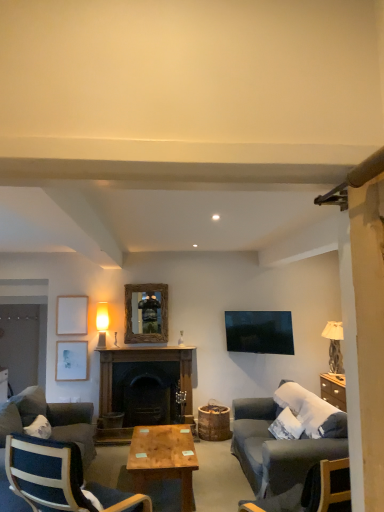
Identify the location of vacant space situated above wooden polished coffee table at center (from a real-world perspective). pos(165,446).